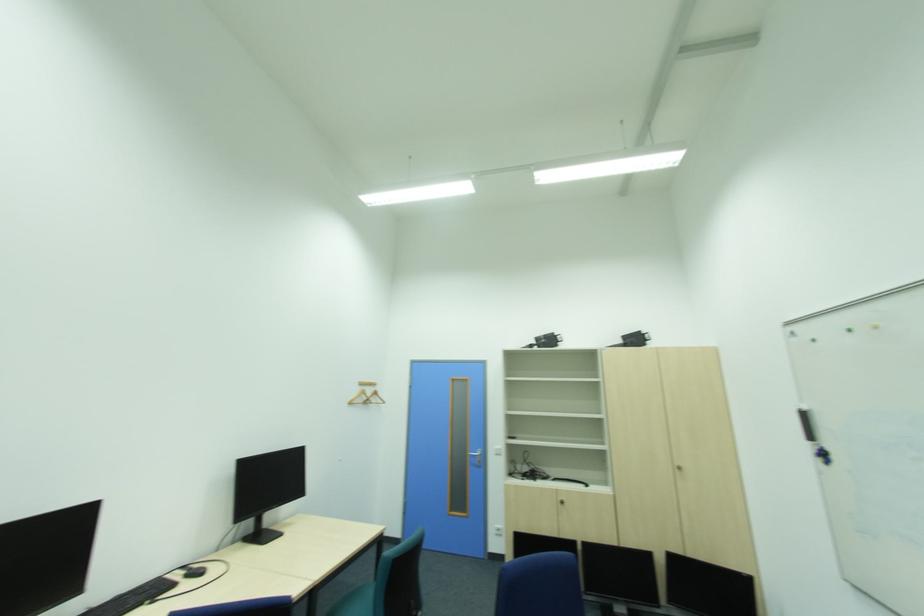
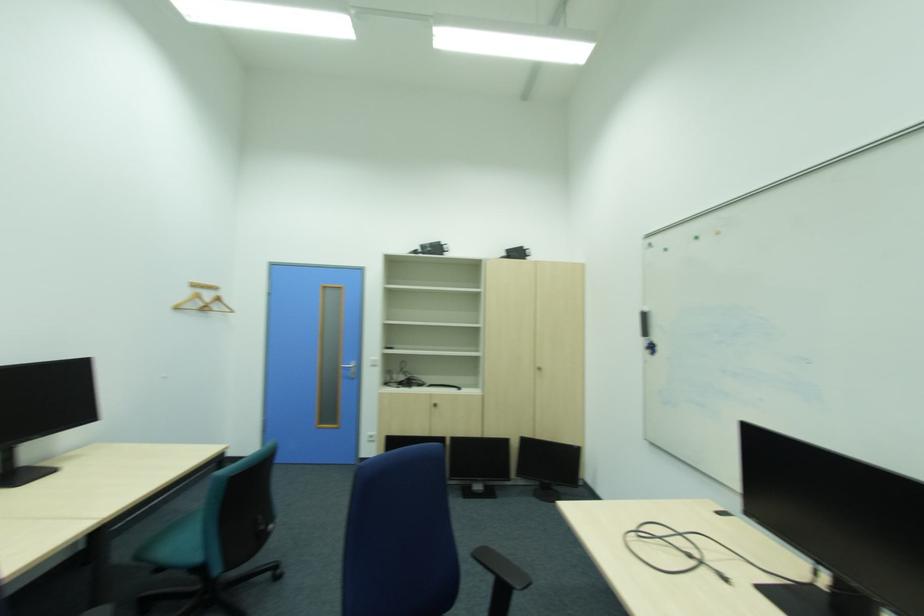
The point at (265, 522) is marked in the first image. Where is the corresponding point in the second image?

(13, 459)